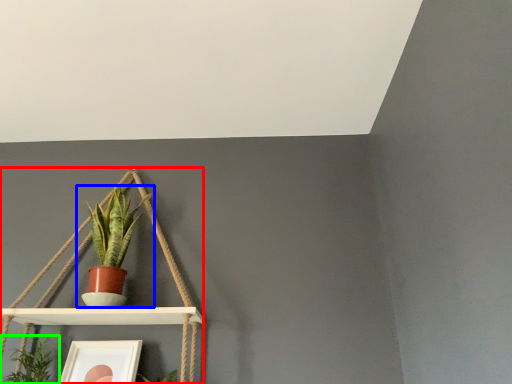
Question: Considering the real-world distances, which object is closest to shelf (highlighted by a red box)? houseplant (highlighted by a blue box) or houseplant (highlighted by a green box).

Choices:
 (A) houseplant
 (B) houseplant

Answer: (A)